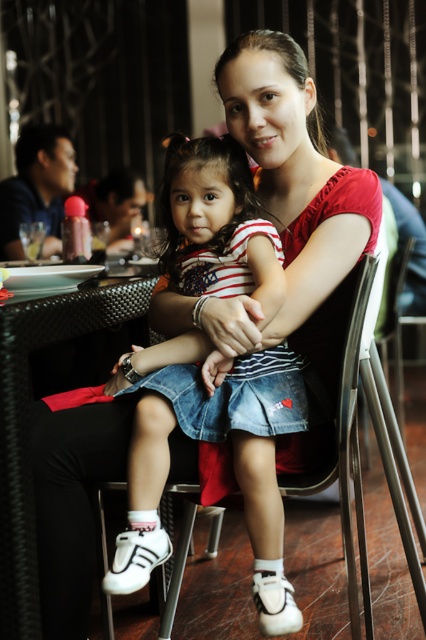
You are a photographer trying to capture the scene from a specific angle. The black woven table at lower left is at point 0.666, 0.068. If you want to frame the shot so that the table is centered in your viewfinder, where should you position your camera relative to the current viewpoint?

The black woven table at lower left is located at point (28,426), so to center it in the viewfinder, the camera should be positioned so that the table is at the center coordinates, which would require moving the camera to the right and upwards from the current viewpoint to align with the table.

You are a waiter in a restaurant and need to place a dessert menu on the table. The menu is 12 inches wide. Can you fit it on the black woven table at lower left without overlapping the metallic silver chair at center?

The black woven table at lower left is in front of the metallic silver chair at center, so there is enough space to place the dessert menu on the table without overlapping the chair.

You are a waiter in a restaurant and need to place a menu on the table. The menu is 12 inches wide. Can you fit it on the black woven table at lower left without overlapping the metallic silver chair at center?

The black woven table at lower left is to the left of the metallic silver chair at center, so placing the menu on the table would not overlap the chair as they are positioned side by side.